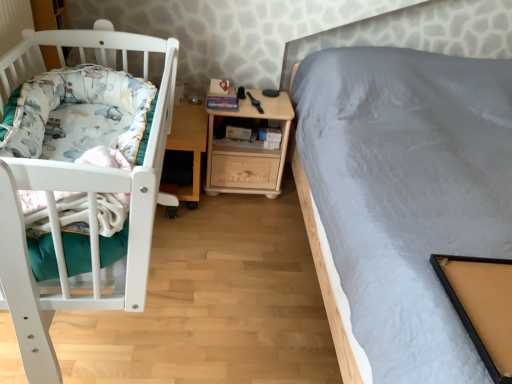
This screenshot has height=384, width=512. Find the location of `empty space that is to the right of wooden table at center`. empty space that is to the right of wooden table at center is located at coordinates (251, 210).